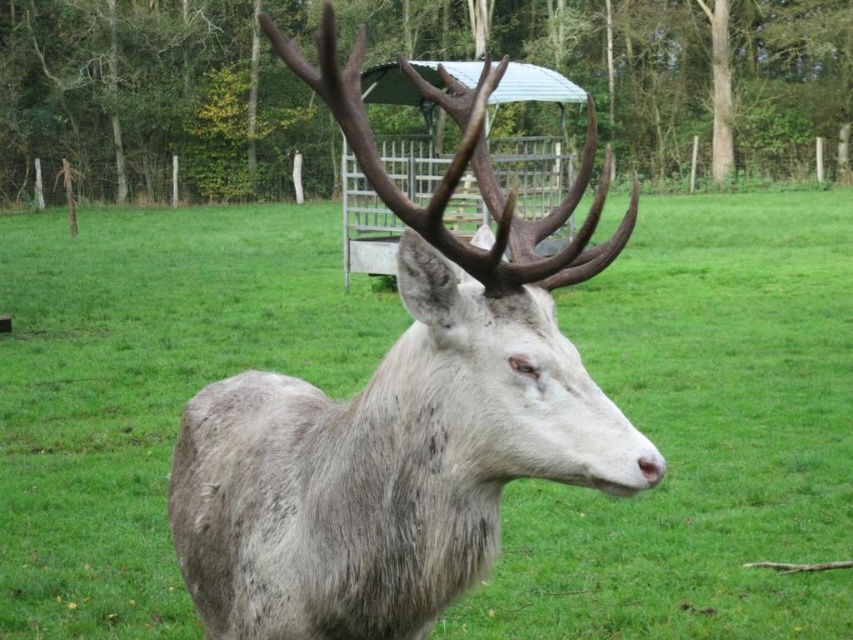
Who is positioned more to the right, fuzzy gray deer at center or gray matte fur at center?

gray matte fur at center is more to the right.

Identify the location of fuzzy gray deer at center. (700, 436).